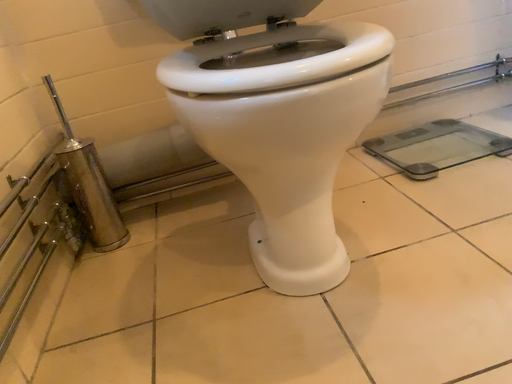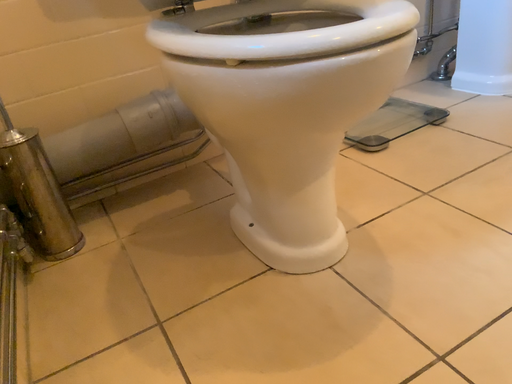
Question: Which way did the camera rotate in the video?

Choices:
 (A) rotated right
 (B) rotated left

Answer: (A)